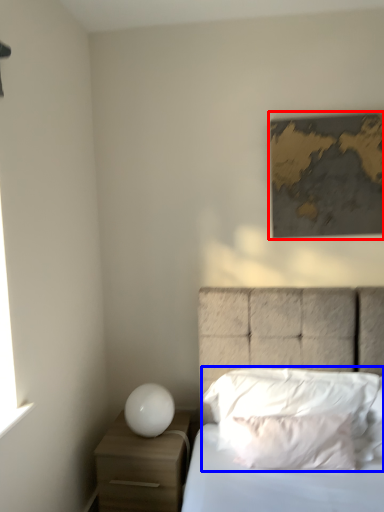
Question: Among these objects, which one is nearest to the camera, picture frame (highlighted by a red box) or pillow (highlighted by a blue box)?

Choices:
 (A) picture frame
 (B) pillow

Answer: (B)